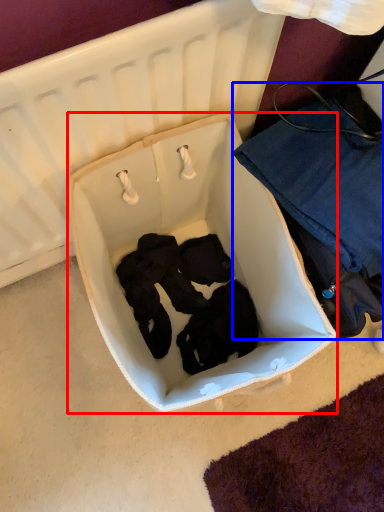
Question: Among these objects, which one is farthest to the camera, infant bed (highlighted by a red box) or clothing (highlighted by a blue box)?

Choices:
 (A) infant bed
 (B) clothing

Answer: (B)